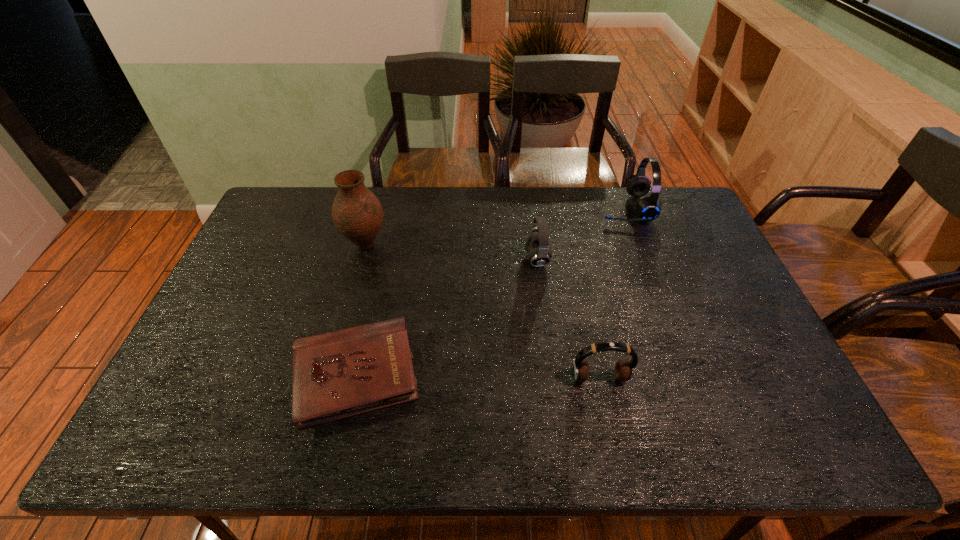
Locate an element on the screen. This screenshot has height=540, width=960. unoccupied area between the shortest object and the second object from right to left is located at coordinates (478, 377).

Locate an element on the screen. Image resolution: width=960 pixels, height=540 pixels. unoccupied area between the leftmost headset and the tallest headset is located at coordinates (581, 233).

Find the location of `free space between the vase and the third object from left to right`. free space between the vase and the third object from left to right is located at coordinates (451, 252).

You are a GUI agent. You are given a task and a screenshot of the screen. Output one action in this format:
    pyautogui.click(x=<x>, y=<y>)
    Task: Click on the unoccupied area between the rightmost object and the fourth object from left to right
    The image size is (960, 540).
    Given the screenshot: What is the action you would take?
    pyautogui.click(x=612, y=293)

Identify the location of the fourth closest object to the rightmost headset. (357, 214).

Point out which object is positioned as the second nearest to the rightmost object. Please provide its 2D coordinates. Your answer should be formatted as a tuple, i.e. [(x, y)], where the tuple contains the x and y coordinates of a point satisfying the conditions above.

[(624, 370)]

In order to click on headset that stands as the second closest to the second tallest object in this screenshot , I will do `click(624, 370)`.

Locate an element on the screen. This screenshot has height=540, width=960. headset that is the closest to the farthest object is located at coordinates (537, 243).

This screenshot has height=540, width=960. What are the coordinates of `vacant space that satisfies the following two spatial constraints: 1. on the ear cups of the leftmost headset; 2. on the front side of the hardback book` in the screenshot? It's located at (552, 376).